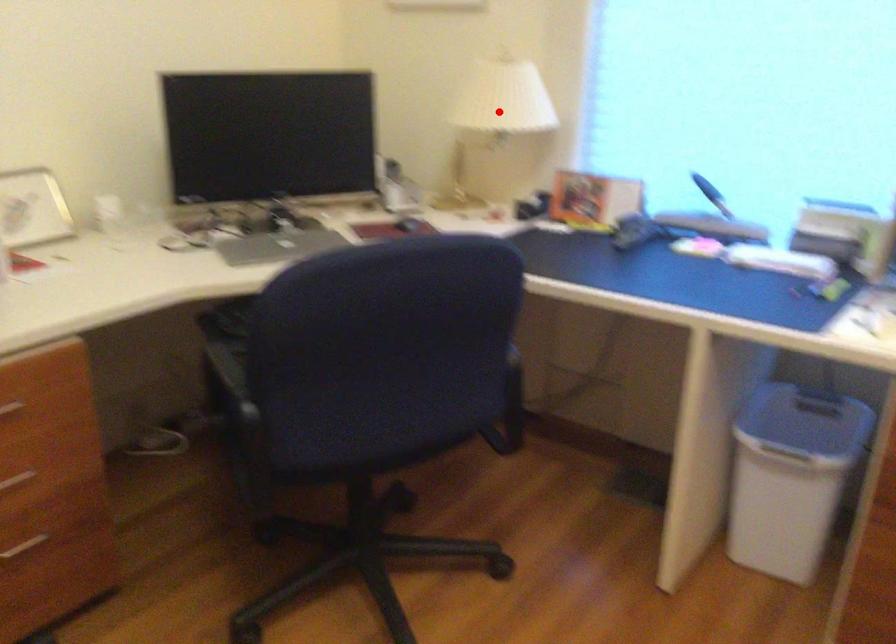
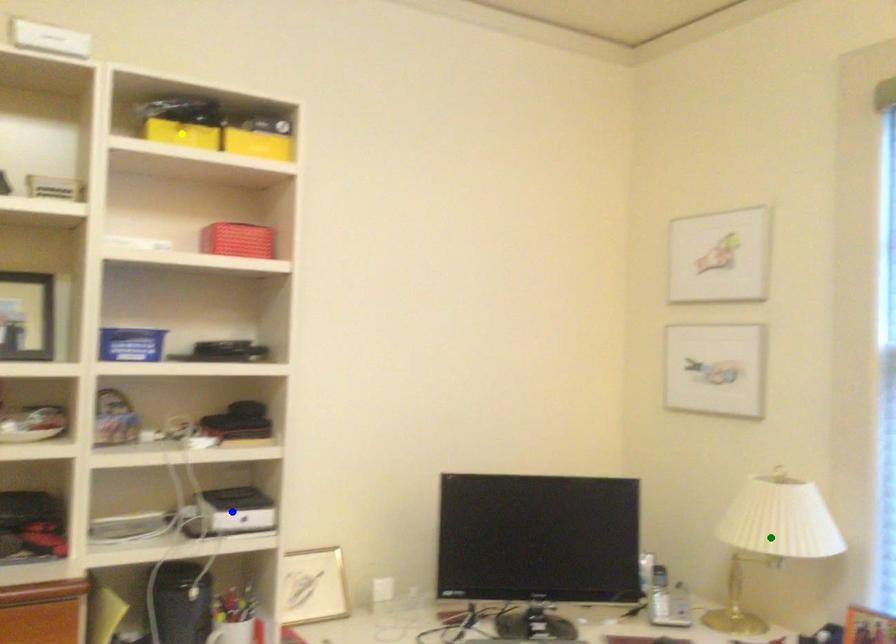
Question: I am providing you with two images of the same scene from different viewpoints. A red point is marked on the first image. You are given multiple points on the second image. Which mark in image 2 goes with the point in image 1?

Choices:
 (A) yellow point
 (B) blue point
 (C) green point

Answer: (C)